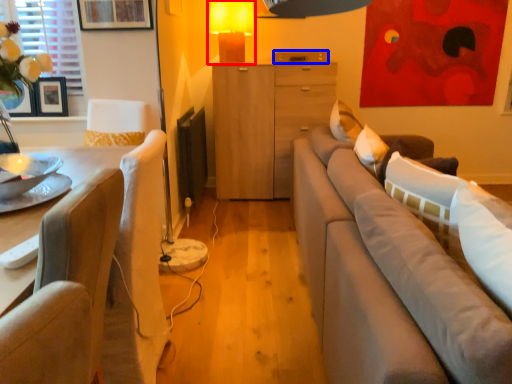
Question: Which object appears closest to the camera in this image, table lamp (highlighted by a red box) or drawer (highlighted by a blue box)?

Choices:
 (A) table lamp
 (B) drawer

Answer: (A)